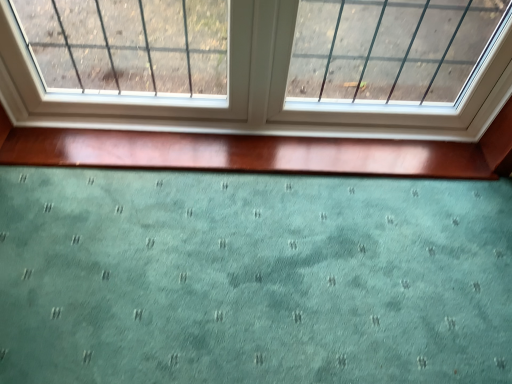
The image size is (512, 384). I want to click on white plastic window at upper center, so pos(252,91).

What do you see at coordinates (252, 91) in the screenshot? I see `white plastic window at upper center` at bounding box center [252, 91].

The width and height of the screenshot is (512, 384). I want to click on white plastic window at upper center, so click(252, 91).